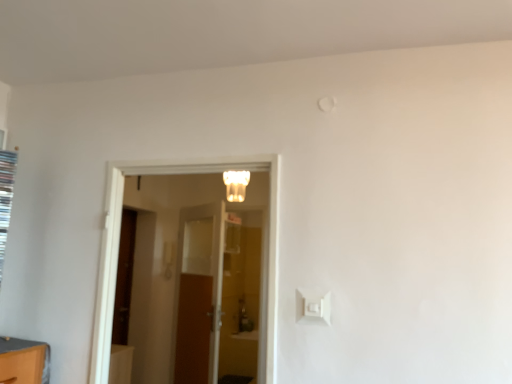
This screenshot has width=512, height=384. Describe the element at coordinates (119, 240) in the screenshot. I see `white glossy door at center, placed as the 1th door when sorted from front to back` at that location.

What do you see at coordinates (199, 294) in the screenshot? The height and width of the screenshot is (384, 512). I see `wooden door at center, the second door positioned from the front` at bounding box center [199, 294].

This screenshot has width=512, height=384. I want to click on white glossy door at center, placed as the 1th door when sorted from front to back, so click(119, 240).

From a real-world perspective, relative to white plastic light switch at lower right, is white glossy door at center, placed as the 1th door when sorted from front to back, vertically above or below?

Clearly, from a real-world perspective, white glossy door at center, placed as the 1th door when sorted from front to back, is above white plastic light switch at lower right.

Considering the relative sizes of white glossy door at center, arranged as the 2th door when viewed from the back, and white plastic light switch at lower right in the image provided, is white glossy door at center, arranged as the 2th door when viewed from the back, bigger than white plastic light switch at lower right?

Yes, white glossy door at center, arranged as the 2th door when viewed from the back, is bigger than white plastic light switch at lower right.

From the image's perspective, which one is positioned lower, white glossy door at center, placed as the 1th door when sorted from front to back, or white plastic light switch at lower right?

white plastic light switch at lower right appears lower in the image.

Where is `light switch directly beneath the white glossy door at center, arranged as the 2th door when viewed from the back (from a real-world perspective)`? This screenshot has width=512, height=384. light switch directly beneath the white glossy door at center, arranged as the 2th door when viewed from the back (from a real-world perspective) is located at coordinates (313, 307).

Consider the image. Is white frosted glass light fixture at center at the back of wooden door at center, the second door positioned from the front?

No, wooden door at center, the second door positioned from the front, is not facing the opposite direction of white frosted glass light fixture at center.

In the scene shown: Is wooden door at center, acting as the first door starting from the back, to the left or to the right of white frosted glass light fixture at center in the image?

wooden door at center, acting as the first door starting from the back, is positioned on white frosted glass light fixture at center's left side.

Is wooden door at center, the second door positioned from the front, positioned in front of white frosted glass light fixture at center?

That is False.

From a real-world perspective, is wooden door at center, acting as the first door starting from the back, positioned above or below white frosted glass light fixture at center?

In terms of real-world spatial position, wooden door at center, acting as the first door starting from the back, is below white frosted glass light fixture at center.

Is wooden door at center, acting as the first door starting from the back, facing towards white glossy door at center, arranged as the 2th door when viewed from the back?

No, wooden door at center, acting as the first door starting from the back, is not turned towards white glossy door at center, arranged as the 2th door when viewed from the back.

What are the coordinates of `door lying on the right of wooden door at center, acting as the first door starting from the back` in the screenshot? It's located at (119, 240).

From the image's perspective, is wooden door at center, the second door positioned from the front, located above white glossy door at center, arranged as the 2th door when viewed from the back?

No.

Considering the relative positions of white frosted glass light fixture at center and white plastic light switch at lower right in the image provided, is white frosted glass light fixture at center to the left or to the right of white plastic light switch at lower right?

white frosted glass light fixture at center is to the left of white plastic light switch at lower right.

Is white frosted glass light fixture at center not inside white plastic light switch at lower right?

That's correct, white frosted glass light fixture at center is outside of white plastic light switch at lower right.

Could you tell me if white frosted glass light fixture at center is facing white plastic light switch at lower right?

No, white frosted glass light fixture at center is not facing towards white plastic light switch at lower right.

In the scene shown: Could you measure the distance between white frosted glass light fixture at center and wooden door at center, acting as the first door starting from the back?

white frosted glass light fixture at center and wooden door at center, acting as the first door starting from the back, are 31.79 inches apart.

Is white frosted glass light fixture at center positioned behind wooden door at center, the second door positioned from the front?

No, it is not.

From the image's perspective, does white frosted glass light fixture at center appear higher than wooden door at center, acting as the first door starting from the back?

Yes, from the image's perspective, white frosted glass light fixture at center is over wooden door at center, acting as the first door starting from the back.

Considering the points (246, 185) and (180, 275), which point is behind, point (246, 185) or point (180, 275)?

Positioned behind is point (180, 275).

How much distance is there between white glossy door at center, arranged as the 2th door when viewed from the back, and white frosted glass light fixture at center?

white glossy door at center, arranged as the 2th door when viewed from the back, and white frosted glass light fixture at center are 3.34 feet apart.

Is white glossy door at center, arranged as the 2th door when viewed from the back, closer to camera compared to white frosted glass light fixture at center?

Yes.

Based on the photo, considering the relative positions of white glossy door at center, placed as the 1th door when sorted from front to back, and white frosted glass light fixture at center in the image provided, is white glossy door at center, placed as the 1th door when sorted from front to back, to the right of white frosted glass light fixture at center from the viewer's perspective?

Result: No, white glossy door at center, placed as the 1th door when sorted from front to back, is not to the right of white frosted glass light fixture at center.

Looking at this image, do you think white glossy door at center, arranged as the 2th door when viewed from the back, is within white frosted glass light fixture at center, or outside of it?

white glossy door at center, arranged as the 2th door when viewed from the back, exists outside the volume of white frosted glass light fixture at center.

Is white frosted glass light fixture at center far away from white glossy door at center, arranged as the 2th door when viewed from the back?

Yes.

Looking at this image, from the image's perspective, is white frosted glass light fixture at center on white glossy door at center, placed as the 1th door when sorted from front to back?

Correct, white frosted glass light fixture at center appears higher than white glossy door at center, placed as the 1th door when sorted from front to back, in the image.

Does white frosted glass light fixture at center lie behind white glossy door at center, placed as the 1th door when sorted from front to back?

Yes, white frosted glass light fixture at center is further from the camera.

The height and width of the screenshot is (384, 512). What are the coordinates of `light switch below the white glossy door at center, placed as the 1th door when sorted from front to back (from the image's perspective)` in the screenshot? It's located at (313, 307).

Locate an element on the screen. This screenshot has height=384, width=512. the 2nd door to the left of the white frosted glass light fixture at center, starting your count from the anchor is located at coordinates (199, 294).

Considering their positions, is wooden door at center, acting as the first door starting from the back, positioned further to white plastic light switch at lower right than white glossy door at center, arranged as the 2th door when viewed from the back?

Based on the image, wooden door at center, acting as the first door starting from the back, appears to be further to white plastic light switch at lower right.

From the image, which object appears to be nearer to white plastic light switch at lower right, white frosted glass light fixture at center or wooden door at center, acting as the first door starting from the back?

white frosted glass light fixture at center is closer to white plastic light switch at lower right.

Which object lies further to the anchor point white glossy door at center, arranged as the 2th door when viewed from the back, white frosted glass light fixture at center or wooden door at center, the second door positioned from the front?

wooden door at center, the second door positioned from the front, is positioned further to the anchor white glossy door at center, arranged as the 2th door when viewed from the back.

When comparing their distances from white frosted glass light fixture at center, does wooden door at center, acting as the first door starting from the back, or white glossy door at center, arranged as the 2th door when viewed from the back, seem further?

white glossy door at center, arranged as the 2th door when viewed from the back, is positioned further to the anchor white frosted glass light fixture at center.

Which object lies nearer to the anchor point wooden door at center, acting as the first door starting from the back, white frosted glass light fixture at center or white glossy door at center, arranged as the 2th door when viewed from the back?

white frosted glass light fixture at center lies closer to wooden door at center, acting as the first door starting from the back, than the other object.

Which object lies nearer to the anchor point white frosted glass light fixture at center, white glossy door at center, arranged as the 2th door when viewed from the back, or white plastic light switch at lower right?

white glossy door at center, arranged as the 2th door when viewed from the back, lies closer to white frosted glass light fixture at center than the other object.

Considering their positions, is wooden door at center, acting as the first door starting from the back, positioned closer to white frosted glass light fixture at center than white plastic light switch at lower right?

wooden door at center, acting as the first door starting from the back, lies closer to white frosted glass light fixture at center than the other object.

Based on their spatial positions, is white plastic light switch at lower right or wooden door at center, the second door positioned from the front, further from white frosted glass light fixture at center?

Among the two, white plastic light switch at lower right is located further to white frosted glass light fixture at center.

Find the location of `door between white plastic light switch at lower right and white frosted glass light fixture at center from front to back`. door between white plastic light switch at lower right and white frosted glass light fixture at center from front to back is located at coordinates (119, 240).

Locate an element on the screen. light fixture between white plastic light switch at lower right and wooden door at center, acting as the first door starting from the back, along the z-axis is located at coordinates (236, 185).

Locate an element on the screen. The height and width of the screenshot is (384, 512). door between white plastic light switch at lower right and wooden door at center, the second door positioned from the front, in the front-back direction is located at coordinates (119, 240).

At what (x,y) coordinates should I click in order to perform the action: click on light fixture between white glossy door at center, arranged as the 2th door when viewed from the back, and wooden door at center, the second door positioned from the front, in the front-back direction. Please return your answer as a coordinate pair (x, y). Looking at the image, I should click on (236, 185).